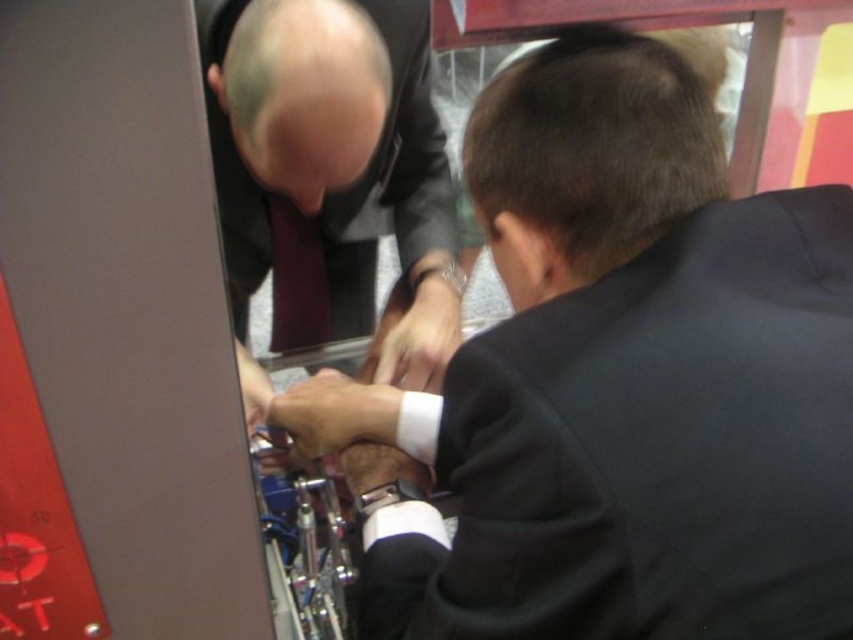
This screenshot has width=853, height=640. What do you see at coordinates (619, 381) in the screenshot?
I see `black suit at center` at bounding box center [619, 381].

Is point (604, 588) closer to viewer compared to point (318, 272)?

Yes, it is.

At what (x,y) coordinates should I click in order to perform the action: click on black suit at center. Please return your answer as a coordinate pair (x, y). This screenshot has height=640, width=853. Looking at the image, I should click on (619, 381).

This screenshot has height=640, width=853. What are the coordinates of `black suit at center` in the screenshot? It's located at (619, 381).

Is shiny black suit at center bigger than matte red tie at center?

Indeed, shiny black suit at center has a larger size compared to matte red tie at center.

Is shiny black suit at center to the left of matte red tie at center from the viewer's perspective?

No, shiny black suit at center is not to the left of matte red tie at center.

The width and height of the screenshot is (853, 640). What do you see at coordinates (334, 160) in the screenshot?
I see `shiny black suit at center` at bounding box center [334, 160].

Where is `shiny black suit at center`? The width and height of the screenshot is (853, 640). shiny black suit at center is located at coordinates (334, 160).

Who is positioned more to the left, black suit at center or shiny black suit at center?

shiny black suit at center is more to the left.

Between black suit at center and shiny black suit at center, which one appears on the right side from the viewer's perspective?

black suit at center

Which is behind, point (825, 404) or point (398, 140)?

Point (398, 140)

I want to click on black suit at center, so click(619, 381).